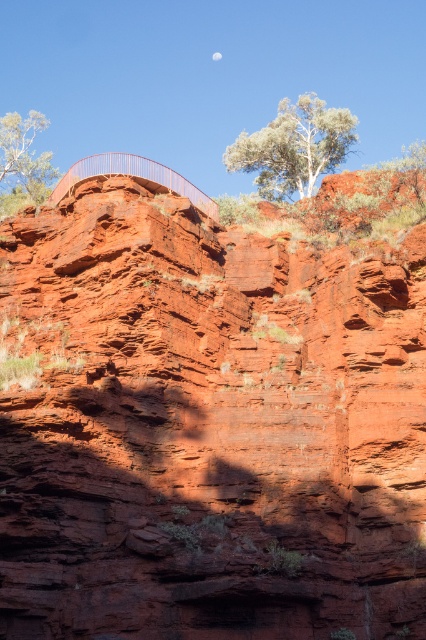
Between reddish-brown rock at upper center and white textured tree at upper center, which one is positioned lower?

reddish-brown rock at upper center is lower down.

Can you confirm if reddish-brown rock at upper center is positioned to the left of white textured tree at upper center?

Yes, reddish-brown rock at upper center is to the left of white textured tree at upper center.

Is point (11, 288) positioned behind point (313, 176)?

That is False.

Where is `reddish-brown rock at upper center`? Image resolution: width=426 pixels, height=640 pixels. reddish-brown rock at upper center is located at coordinates (213, 416).

Can you confirm if white textured tree at upper center is taller than metallic railing at upper center?

Correct, white textured tree at upper center is much taller as metallic railing at upper center.

Does white textured tree at upper center appear over metallic railing at upper center?

Correct, white textured tree at upper center is located above metallic railing at upper center.

Which is behind, point (284, 120) or point (85, 164)?

Positioned behind is point (284, 120).

At what (x,y) coordinates should I click in order to perform the action: click on white textured tree at upper center. Please return your answer as a coordinate pair (x, y). The image size is (426, 640). Looking at the image, I should click on (293, 147).

Who is lower down, green leafy tree at upper left or metallic railing at upper center?

Positioned lower is metallic railing at upper center.

Is green leafy tree at upper left bigger than metallic railing at upper center?

Yes.

Find the location of `green leafy tree at upper left`. green leafy tree at upper left is located at coordinates (23, 163).